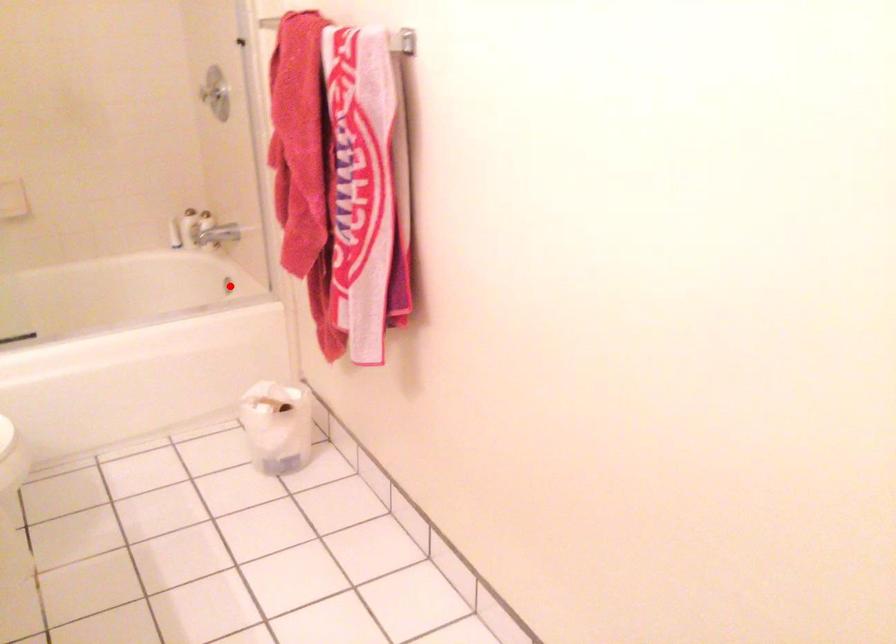
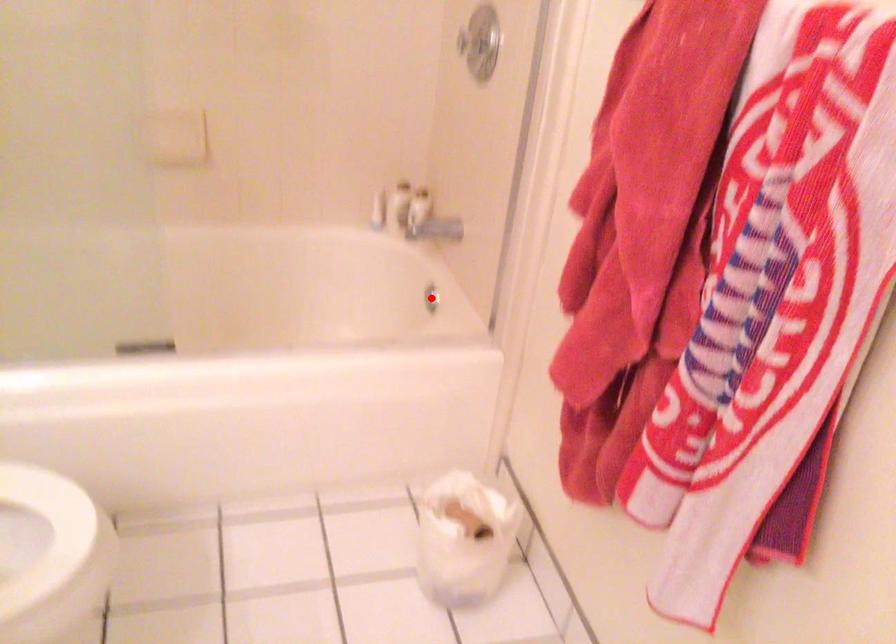
I am providing you with two images of the same scene from different viewpoints. A red point is marked on the first image and another point is marked on the second image. Does the point marked in image1 correspond to the same location as the one in image2?

Yes